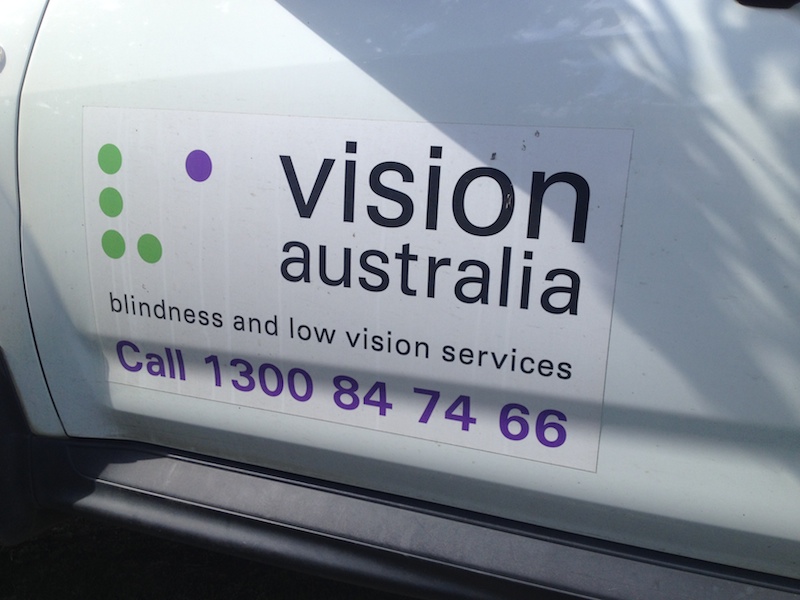
Identify the location of handle. Image resolution: width=800 pixels, height=600 pixels. (785, 26).